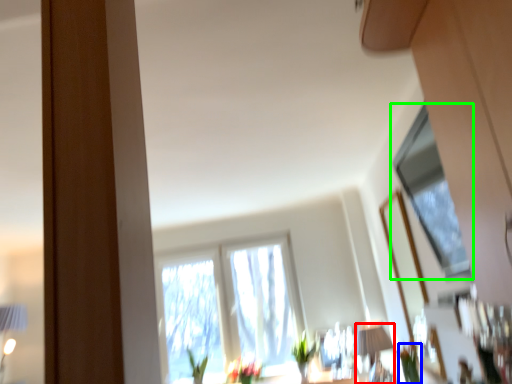
Question: Which object is the closest to the table lamp (highlighted by a red box)? Choose among these: plant (highlighted by a blue box) or window (highlighted by a green box).

Choices:
 (A) plant
 (B) window

Answer: (A)